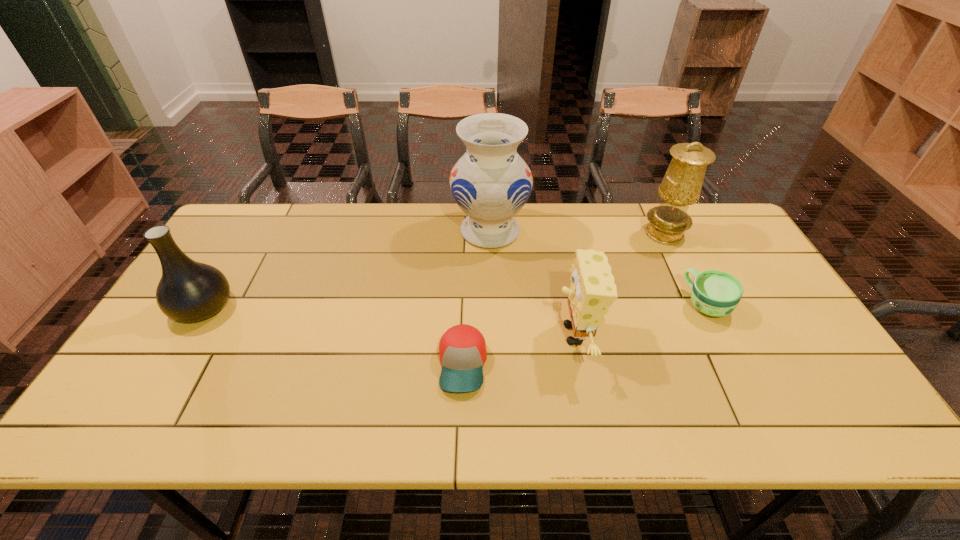
Find the location of a particular element. vacant space situated on the front of the leftmost object is located at coordinates (145, 404).

This screenshot has height=540, width=960. What are the coordinates of `free space located on the face of the fourth object from left to right` in the screenshot? It's located at (460, 334).

Identify the location of free spot located on the face of the fourth object from left to right. The image size is (960, 540). (480, 334).

Image resolution: width=960 pixels, height=540 pixels. In order to click on free spot located on the face of the fourth object from left to right in this screenshot , I will do `click(530, 334)`.

Image resolution: width=960 pixels, height=540 pixels. Identify the location of vacant space located 0.140m on the front of the fifth tallest object. (738, 369).

Locate an element on the screen. The image size is (960, 540). vase that is at the far edge is located at coordinates (491, 183).

Identify the location of oil lamp located at the far edge. (681, 186).

Where is `object that is at the left edge`? object that is at the left edge is located at coordinates (188, 291).

I want to click on object that is at the right edge, so click(x=715, y=293).

Locate an element on the screen. The width and height of the screenshot is (960, 540). vacant point at the far edge is located at coordinates (576, 228).